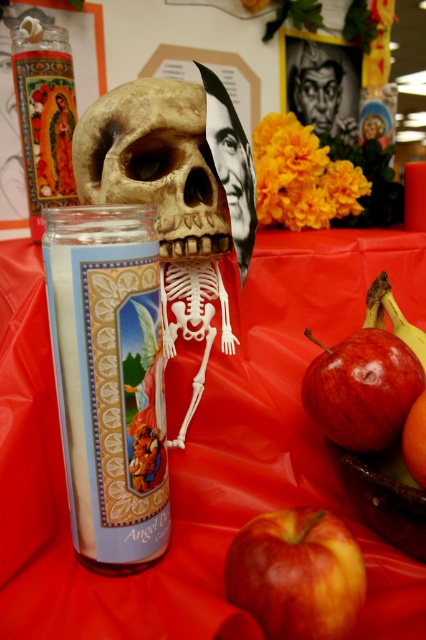
Question: Is smooth black face at upper center to the left of yellow smooth banana at center-right from the viewer's perspective?

Choices:
 (A) no
 (B) yes

Answer: (A)

Question: Considering the real-world distances, which object is farthest from the brown matte skull at center?

Choices:
 (A) shiny red apple at lower right
 (B) yellow smooth banana at center-right
 (C) shiny red apple at lower center

Answer: (C)

Question: Considering the relative positions of shiny red apple at lower right and orange matte at lower right in the image provided, where is shiny red apple at lower right located with respect to orange matte at lower right?

Choices:
 (A) below
 (B) above

Answer: (B)

Question: Which point is closer to the camera?

Choices:
 (A) (316, 509)
 (B) (365, 358)

Answer: (A)

Question: Among these points, which one is nearest to the camera?

Choices:
 (A) (72, 214)
 (B) (201, 560)

Answer: (A)

Question: Is brown matte skull at center bigger than shiny red apple at lower right?

Choices:
 (A) yes
 (B) no

Answer: (A)